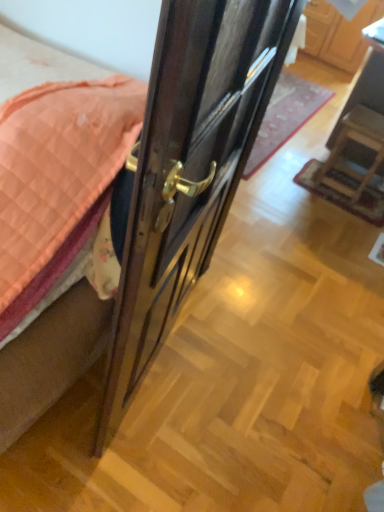
Measure the distance between point (351, 68) and camera.

The distance of point (351, 68) from camera is 13.10 feet.

Measure the distance between polished brass door handle at center and camera.

polished brass door handle at center and camera are 2.53 meters apart from each other.

The height and width of the screenshot is (512, 384). What do you see at coordinates (358, 143) in the screenshot?
I see `wooden chair at right` at bounding box center [358, 143].

Where is `wooden cabinet at upper center`? wooden cabinet at upper center is located at coordinates (339, 33).

What's the angular difference between polished brass door handle at center and wooden cabinet at upper center's facing directions?

The angle between the facing direction of polished brass door handle at center and the facing direction of wooden cabinet at upper center is 1.27 degrees.

Is polished brass door handle at center directly adjacent to wooden cabinet at upper center?

polished brass door handle at center and wooden cabinet at upper center are not in contact.

From a real-world perspective, which is physically below, polished brass door handle at center or wooden cabinet at upper center?

polished brass door handle at center.

Is wooden cabinet at upper center at the back of polished brass door handle at center?

No, polished brass door handle at center's orientation is not away from wooden cabinet at upper center.

Is there a large distance between wooden chair at right and polished brass door handle at center?

They are positioned close to each other.

Which is closer, (x=320, y=170) or (x=286, y=81)?

Point (x=320, y=170).

Looking at this image, does wooden chair at right have a lesser width compared to wooden cabinet at upper center?

Indeed, wooden chair at right has a lesser width compared to wooden cabinet at upper center.

Is wooden chair at right aimed at wooden cabinet at upper center?

No, wooden chair at right is not aimed at wooden cabinet at upper center.

Between wooden chair at right and wooden cabinet at upper center, which one is positioned in front?

wooden chair at right is in front.

Is point (352, 109) farther from viewer compared to point (364, 24)?

No.

Considering the relative positions of polished brass door handle at center and brown fabric bed frame at left in the image provided, is polished brass door handle at center to the left of brown fabric bed frame at left from the viewer's perspective?

No, polished brass door handle at center is not to the left of brown fabric bed frame at left.

How distant is polished brass door handle at center from brown fabric bed frame at left?

polished brass door handle at center is 2.01 meters away from brown fabric bed frame at left.

You are a GUI agent. You are given a task and a screenshot of the screen. Output one action in this format:
    pyautogui.click(x=<x>, y=<y>)
    Task: Click on the plain behind the brown fabric bed frame at left
    The image size is (384, 512).
    Given the screenshot: What is the action you would take?
    pyautogui.click(x=285, y=117)

Considering the positions of objects polished brass door handle at center and brown fabric bed frame at left in the image provided, who is in front, polished brass door handle at center or brown fabric bed frame at left?

brown fabric bed frame at left is more forward.

From the image's perspective, is polished brass door handle at center located beneath wooden chair at right?

No, from the image's perspective, polished brass door handle at center is not beneath wooden chair at right.

Considering their positions, is polished brass door handle at center located in front of or behind wooden chair at right?

In the image, polished brass door handle at center appears behind wooden chair at right.

Is point (283, 123) positioned before point (358, 133)?

That is False.

What's the angular difference between polished brass door handle at center and wooden chair at right's facing directions?

92.8 degrees separate the facing orientations of polished brass door handle at center and wooden chair at right.

Is glossy wood door at center positioned beyond the bounds of wooden cabinet at upper center?

That's correct, glossy wood door at center is outside of wooden cabinet at upper center.

Can you see glossy wood door at center touching wooden cabinet at upper center?

No, glossy wood door at center is not in contact with wooden cabinet at upper center.

Between glossy wood door at center and wooden cabinet at upper center, which one has smaller size?

With smaller size is glossy wood door at center.

Looking at this image, does glossy wood door at center lie behind wooden cabinet at upper center?

No, glossy wood door at center is in front of wooden cabinet at upper center.

Is wooden cabinet at upper center closer to camera compared to glossy wood door at center?

No, wooden cabinet at upper center is further to the viewer.

Between point (343, 62) and point (162, 140), which one is positioned behind?

Positioned behind is point (343, 62).

Is wooden cabinet at upper center facing away from glossy wood door at center?

That's not correct — wooden cabinet at upper center is not looking away from glossy wood door at center.

Measure the distance from wooden cabinet at upper center to glossy wood door at center.

A distance of 3.21 meters exists between wooden cabinet at upper center and glossy wood door at center.

This screenshot has height=512, width=384. In order to click on cabinetry lying above the polished brass door handle at center (from the image's perspective) in this screenshot , I will do `click(339, 33)`.

Identify the location of furniture that is on the right side of polished brass door handle at center. (358, 143).

Consider the image. Considering their positions, is wooden cabinet at upper center positioned closer to wooden chair at right than brown fabric bed frame at left?

wooden cabinet at upper center.

Looking at the image, which one is located further to wooden chair at right, brown fabric bed frame at left or polished brass door handle at center?

Based on the image, brown fabric bed frame at left appears to be further to wooden chair at right.

Considering their positions, is glossy wood door at center positioned closer to wooden cabinet at upper center than polished brass door handle at center?

The object closer to wooden cabinet at upper center is polished brass door handle at center.

Estimate the real-world distances between objects in this image. Which object is closer to glossy wood door at center, brown fabric bed frame at left or polished brass door handle at center?

Based on the image, brown fabric bed frame at left appears to be nearer to glossy wood door at center.

Based on their spatial positions, is wooden cabinet at upper center or polished brass door handle at center further from brown fabric bed frame at left?

The object further to brown fabric bed frame at left is wooden cabinet at upper center.

Looking at this image, when comparing their distances from glossy wood door at center, does wooden chair at right or wooden cabinet at upper center seem closer?

wooden chair at right.

From the image, which object appears to be farther from polished brass door handle at center, brown fabric bed frame at left or wooden chair at right?

Based on the image, brown fabric bed frame at left appears to be further to polished brass door handle at center.

Estimate the real-world distances between objects in this image. Which object is further from glossy wood door at center, wooden cabinet at upper center or wooden chair at right?

wooden cabinet at upper center is positioned further to the anchor glossy wood door at center.

What are the coordinates of `plain between wooden chair at right and wooden cabinet at upper center in the front-back direction` in the screenshot? It's located at (285, 117).

The image size is (384, 512). I want to click on furniture located between glossy wood door at center and polished brass door handle at center in the depth direction, so click(x=358, y=143).

You are a GUI agent. You are given a task and a screenshot of the screen. Output one action in this format:
    pyautogui.click(x=<x>, y=<y>)
    Task: Click on the bed frame positioned between glossy wood door at center and wooden cabinet at upper center from near to far
    The height and width of the screenshot is (512, 384).
    Given the screenshot: What is the action you would take?
    pyautogui.click(x=50, y=358)

You are a GUI agent. You are given a task and a screenshot of the screen. Output one action in this format:
    pyautogui.click(x=<x>, y=<y>)
    Task: Click on the furniture between brown fabric bed frame at left and wooden cabinet at upper center in the front-back direction
    
    Given the screenshot: What is the action you would take?
    pyautogui.click(x=358, y=143)